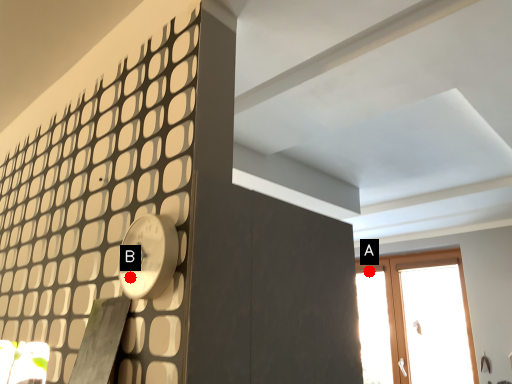
Question: Two points are circled on the image, labeled by A and B beside each circle. Which point is closer to the camera?

Choices:
 (A) A is closer
 (B) B is closer

Answer: (B)